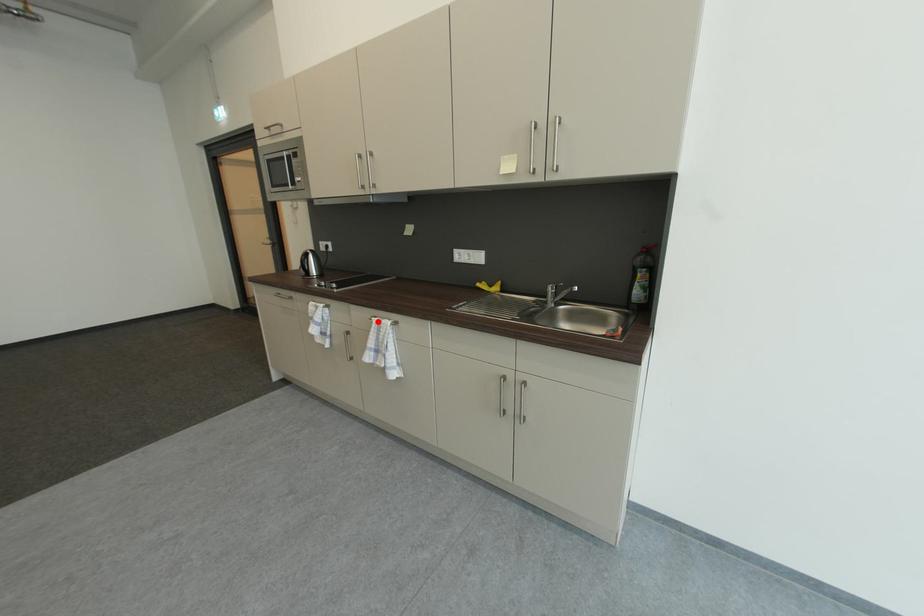
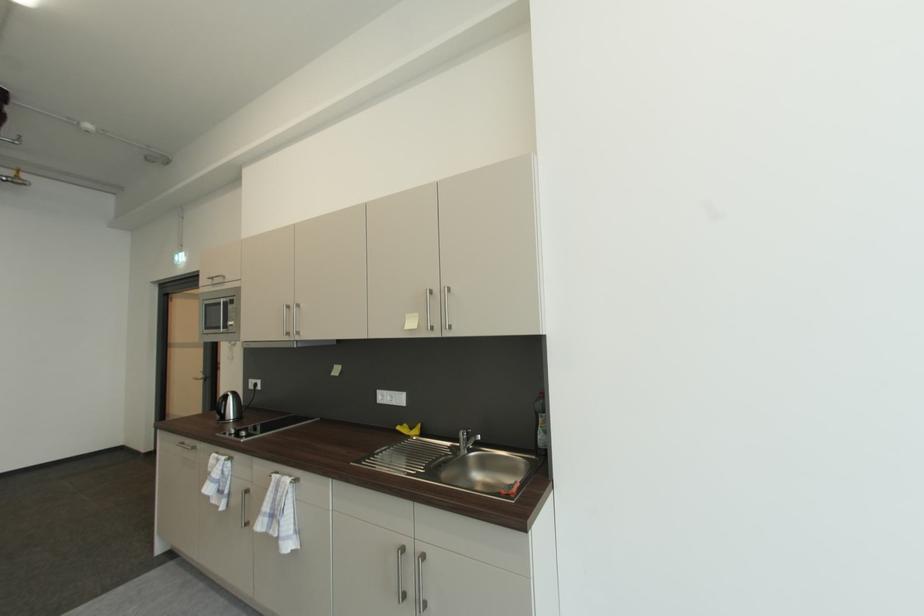
Find the pixel in the second image that matches the highlighted location in the first image.

(277, 477)